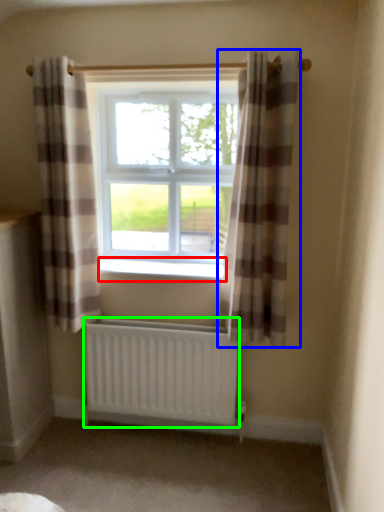
Question: Which is nearer to the window sill (highlighted by a red box)? curtain (highlighted by a blue box) or radiator (highlighted by a green box).

Choices:
 (A) curtain
 (B) radiator

Answer: (A)